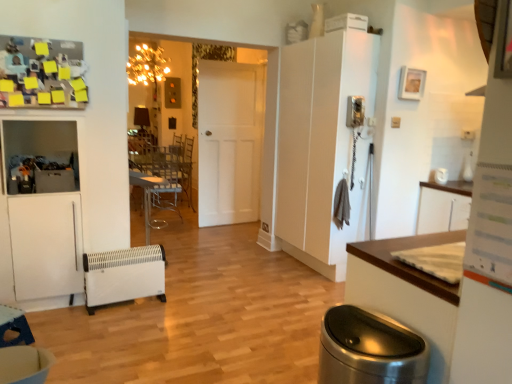
The image size is (512, 384). Identify the location of vacant space to the right of metallic silver table at center, which is the first table in top-to-bottom order. (186, 268).